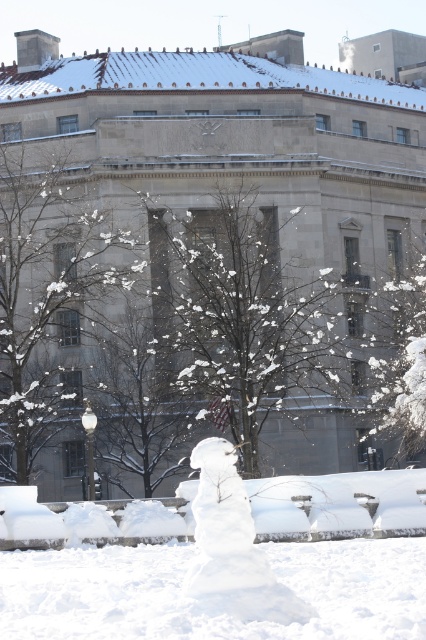
Does white fluffy snowman at lower center have a larger size compared to snow-covered branches at left?

Actually, white fluffy snowman at lower center might be smaller than snow-covered branches at left.

Describe the element at coordinates (196, 604) in the screenshot. The height and width of the screenshot is (640, 426). I see `white fluffy snowman at lower center` at that location.

The width and height of the screenshot is (426, 640). Find the location of `white fluffy snowman at lower center`. white fluffy snowman at lower center is located at coordinates (196, 604).

Between point (285, 570) and point (282, 602), which one is positioned in front?

Point (282, 602) is more forward.

Which is behind, point (74, 598) or point (230, 502)?

Positioned behind is point (74, 598).

What do you see at coordinates (196, 604) in the screenshot?
I see `white fluffy snowman at lower center` at bounding box center [196, 604].

I want to click on white fluffy snowman at lower center, so tap(196, 604).

Which of these two, beige stone building at center or white fluffy snowman at lower center, stands shorter?

Standing shorter between the two is white fluffy snowman at lower center.

Between beige stone building at center and white fluffy snowman at lower center, which one appears on the right side from the viewer's perspective?

white fluffy snowman at lower center is more to the right.

Where is `beige stone building at center`? Image resolution: width=426 pixels, height=640 pixels. beige stone building at center is located at coordinates (232, 147).